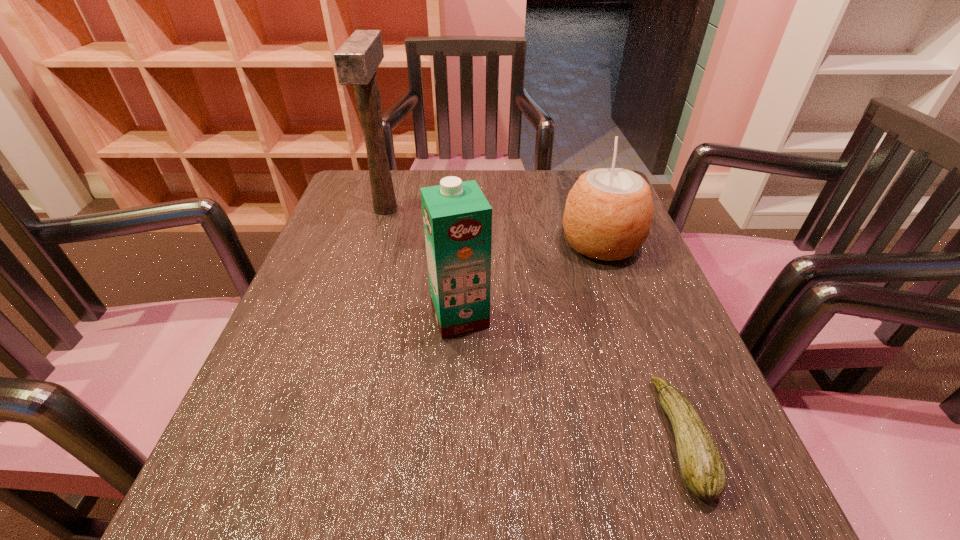
This screenshot has height=540, width=960. In order to click on blank area located at the stem end of the zucchini in this screenshot , I will do (559, 438).

Where is `vacant space located 0.340m at the stem end of the zucchini`? Image resolution: width=960 pixels, height=540 pixels. vacant space located 0.340m at the stem end of the zucchini is located at coordinates coord(427,438).

In order to click on vacant space located at the stem end of the zucchini in this screenshot , I will do `click(427, 438)`.

Identify the location of object located at the far edge. (356, 61).

Find the location of a particular element. The image size is (960, 540). object positioned at the near edge is located at coordinates (702, 468).

This screenshot has width=960, height=540. Identify the location of object that is at the left edge. (356, 61).

Where is `coconut located at the right edge`? The image size is (960, 540). coconut located at the right edge is located at coordinates (608, 213).

Identify the location of zucchini that is at the right edge. The width and height of the screenshot is (960, 540). [x=702, y=468].

At what (x,y) coordinates should I click in order to perform the action: click on object at the far left corner. Please return your answer as a coordinate pair (x, y). Looking at the image, I should click on (356, 61).

Locate an element on the screen. object that is at the near right corner is located at coordinates (702, 468).